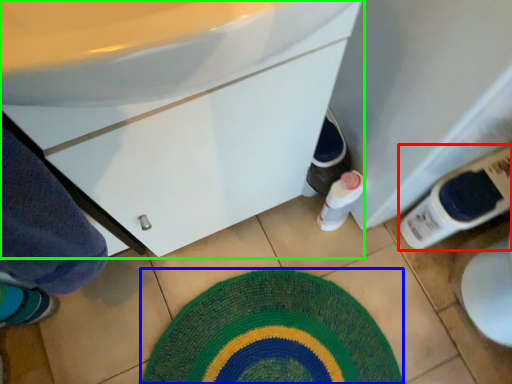
Question: Considering the real-world distances, which object is closest to bottle (highlighted by a red box)? bath mat (highlighted by a blue box) or bathroom cabinet (highlighted by a green box).

Choices:
 (A) bath mat
 (B) bathroom cabinet

Answer: (A)